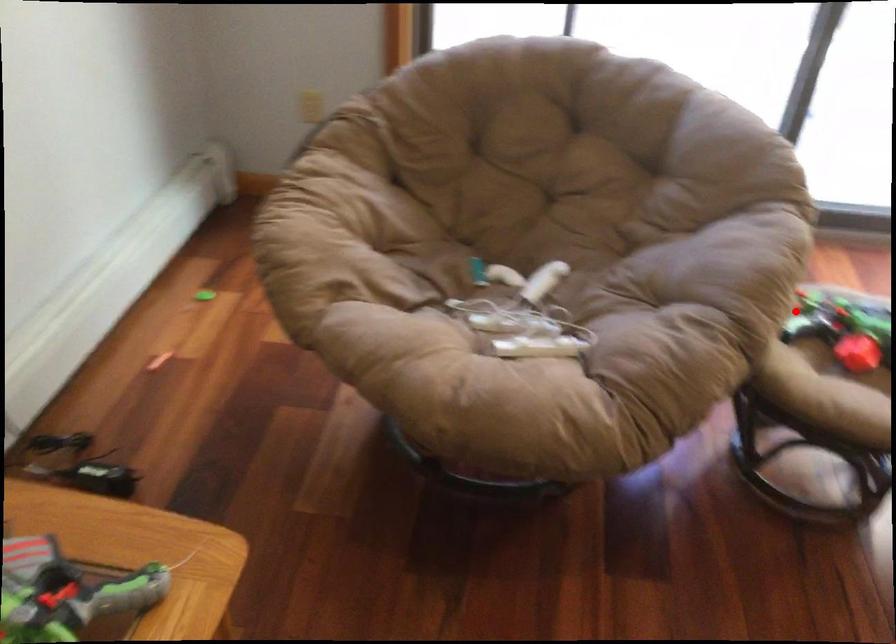
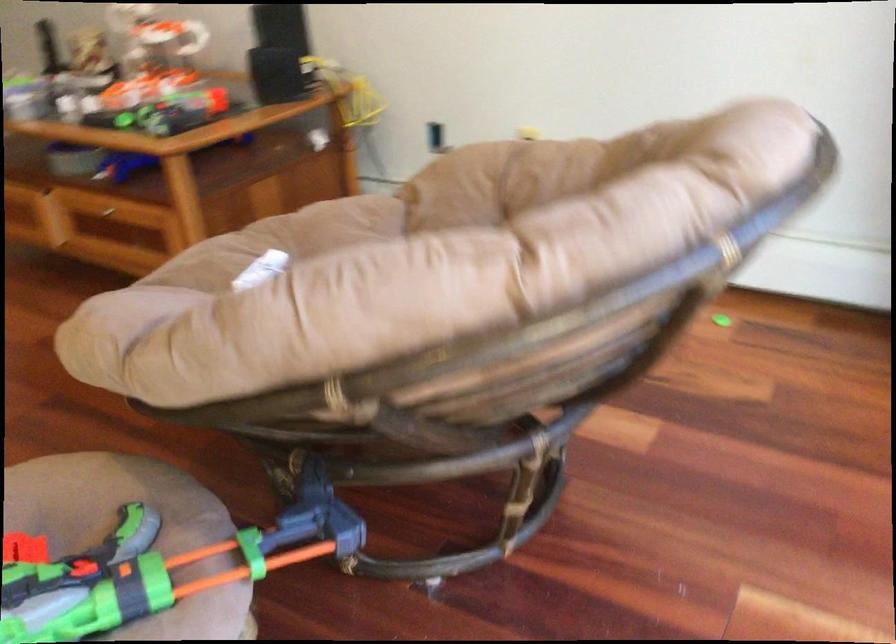
Question: I am providing you with two images of the same scene from different viewpoints. In image1, a red point is highlighted. Considering the same 3D point in image2, which of the following is correct?

Choices:
 (A) It is closer
 (B) It is farther

Answer: (A)